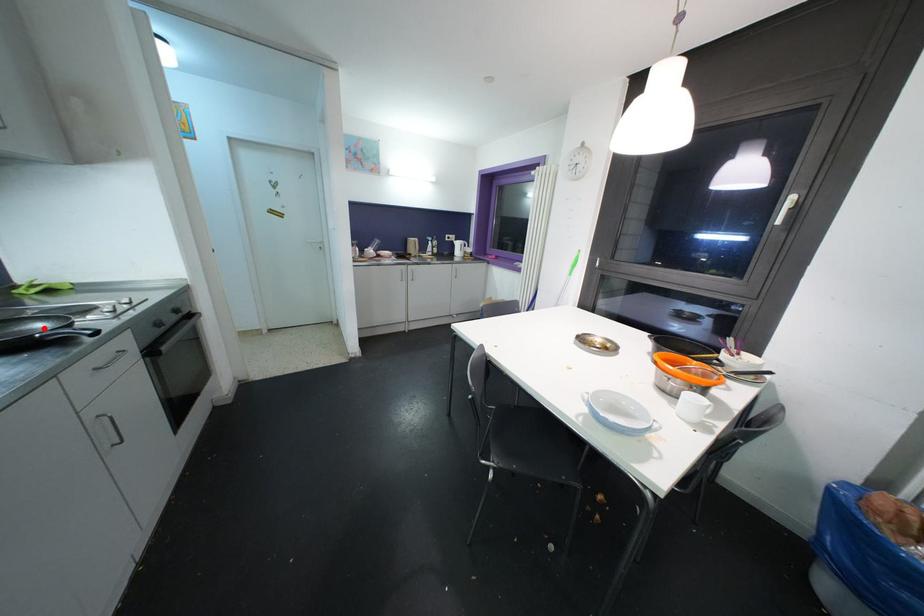
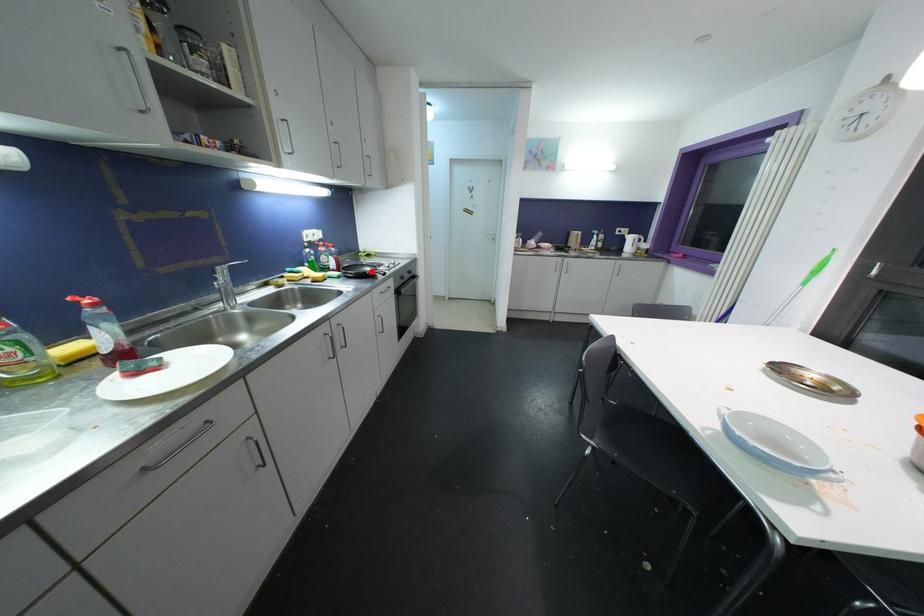
I am providing you with two images of the same scene from different viewpoints. A red point is marked on the first image and another point is marked on the second image. Do the highlighted points in image1 and image2 indicate the same real-world spot?

Yes